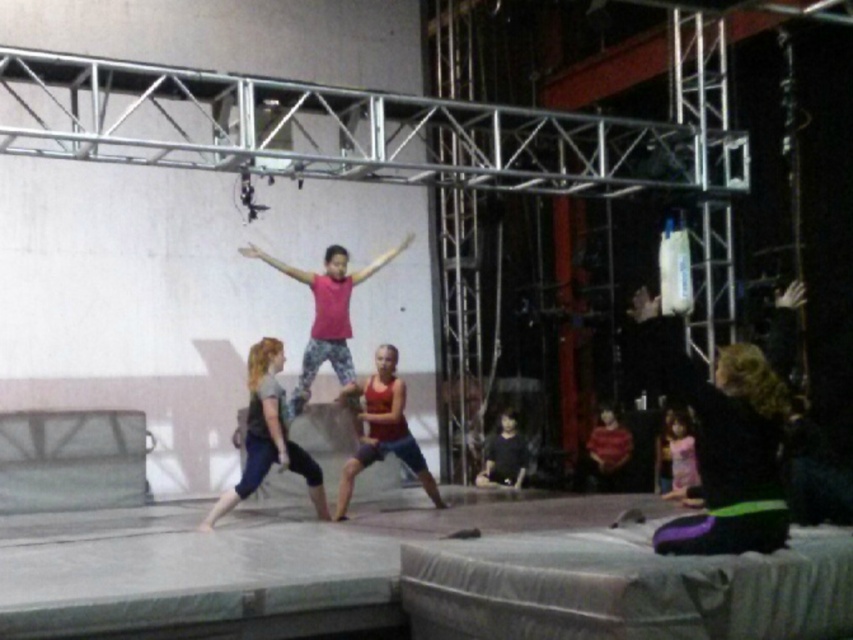
Is matte gray leggings at center positioned in front of pink fabric dress at lower right?

Yes.

The height and width of the screenshot is (640, 853). Describe the element at coordinates (268, 435) in the screenshot. I see `matte gray leggings at center` at that location.

Is point (270, 406) farther from viewer compared to point (686, 481)?

No, it is in front of (686, 481).

Find the location of a particular element. The image size is (853, 640). matte gray leggings at center is located at coordinates (268, 435).

Is black fabric dress at lower right below matte gray leggings at center?

No, black fabric dress at lower right is not below matte gray leggings at center.

Does point (711, 516) come closer to viewer compared to point (258, 381)?

Yes.

This screenshot has width=853, height=640. Identify the location of black fabric dress at lower right. pyautogui.click(x=724, y=442).

Looking at this image, between matte gray leggings at center and red fabric tank top at center, which one is positioned higher?

Positioned higher is matte gray leggings at center.

Between point (267, 458) and point (346, 387), which one is positioned behind?

Point (346, 387)

Where is `matte gray leggings at center`? matte gray leggings at center is located at coordinates (268, 435).